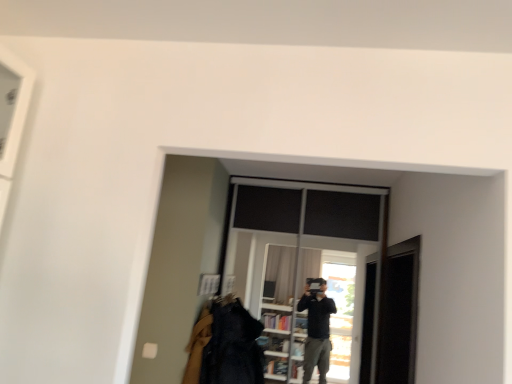
Question: Looking at the image, does transparent glass screen door at right seem bigger or smaller compared to denim jacket at lower center?

Choices:
 (A) big
 (B) small

Answer: (A)

Question: From the image's perspective, is transparent glass screen door at right positioned above or below denim jacket at lower center?

Choices:
 (A) below
 (B) above

Answer: (B)

Question: Which of these objects is positioned farthest from the denim jacket at lower center?

Choices:
 (A) transparent glass screen door at right
 (B) transparent glass window at center

Answer: (A)

Question: Which object is positioned closest to the denim jacket at lower center?

Choices:
 (A) transparent glass window at center
 (B) transparent glass screen door at right

Answer: (A)